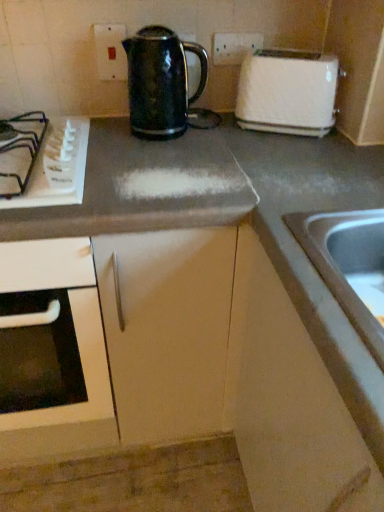
At what (x,y) coordinates should I click in order to perform the action: click on free spot to the left of white plastic toaster at upper right. Please return your answer as a coordinate pair (x, y). This screenshot has width=384, height=512. Looking at the image, I should click on (226, 132).